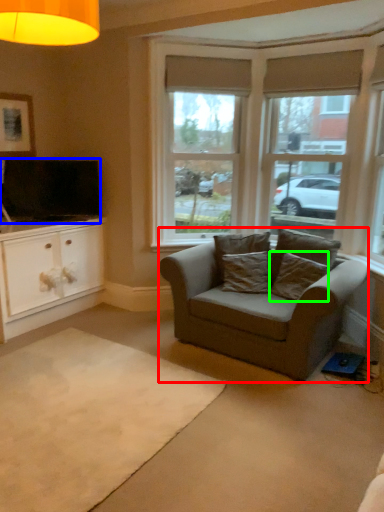
Question: Based on their relative distances, which object is farther from studio couch (highlighted by a red box)? Choose from television (highlighted by a blue box) and pillow (highlighted by a green box).

Choices:
 (A) television
 (B) pillow

Answer: (A)